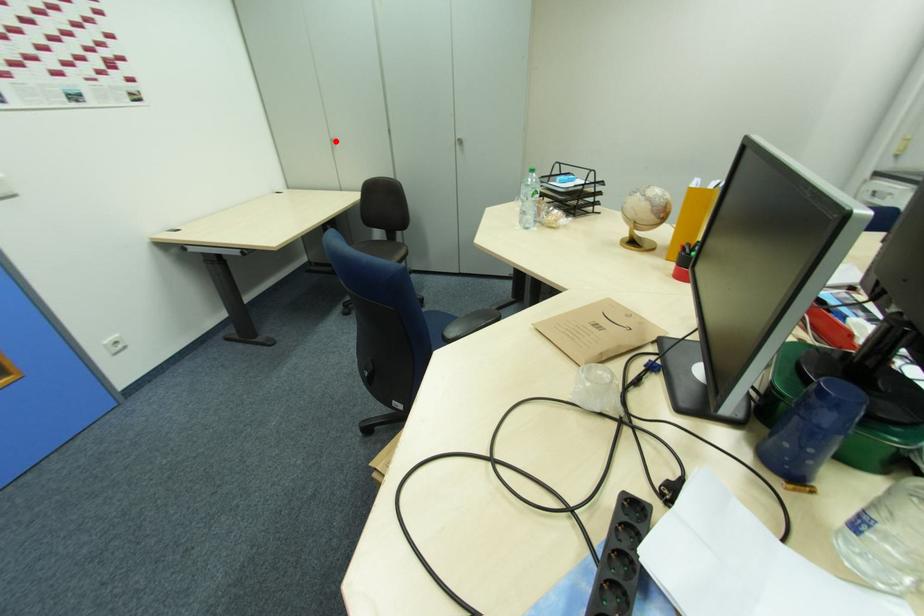
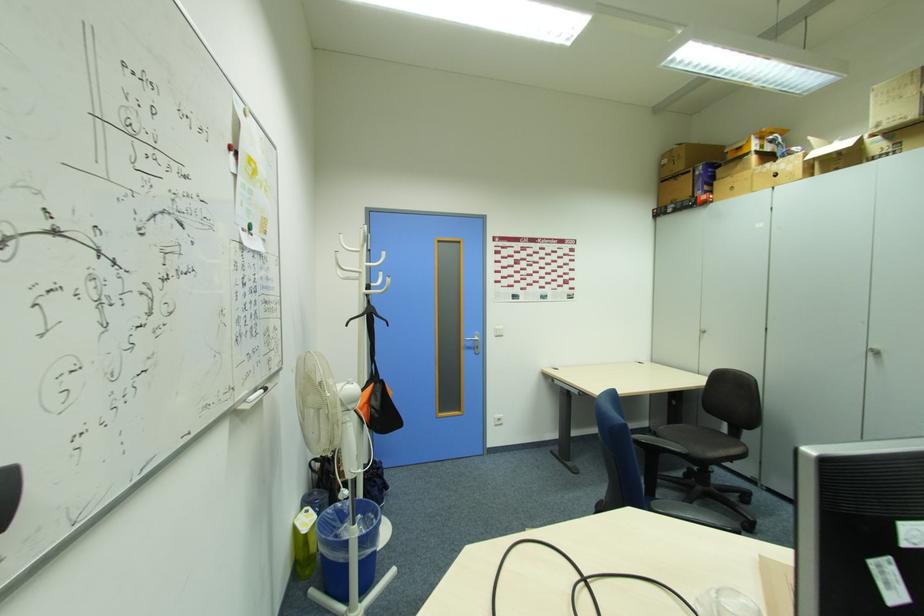
Where in the second image is the point corresponding to the highlighted location from the first image?

(703, 331)